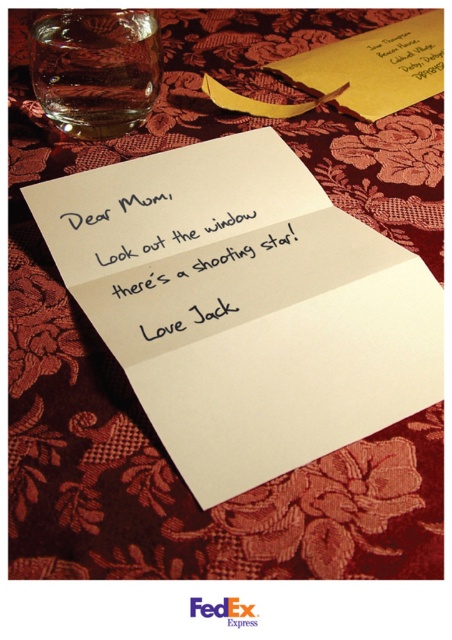
Who is positioned more to the left, white paper at center or yellow paper envelope at upper center?

white paper at center is more to the left.

Between point (175, 262) and point (339, 80), which one is positioned behind?

Positioned behind is point (339, 80).

The image size is (452, 640). In order to click on white paper at center in this screenshot , I will do `click(202, 288)`.

Is yellow paper envelope at upper center to the left of colored paper note at upper right from the viewer's perspective?

Indeed, yellow paper envelope at upper center is positioned on the left side of colored paper note at upper right.

Between yellow paper envelope at upper center and colored paper note at upper right, which one is positioned lower?

yellow paper envelope at upper center is lower down.

What do you see at coordinates (357, 72) in the screenshot? The height and width of the screenshot is (640, 452). I see `yellow paper envelope at upper center` at bounding box center [357, 72].

Locate an element on the screen. This screenshot has height=640, width=452. yellow paper envelope at upper center is located at coordinates (357, 72).

Can you confirm if white paper at center is smaller than colored paper note at upper right?

Indeed, white paper at center has a smaller size compared to colored paper note at upper right.

Is white paper at center closer to camera compared to colored paper note at upper right?

That is True.

Is point (245, 243) positioned after point (419, 49)?

No, (245, 243) is in front of (419, 49).

Where is `white paper at center`? Image resolution: width=452 pixels, height=640 pixels. white paper at center is located at coordinates (202, 288).